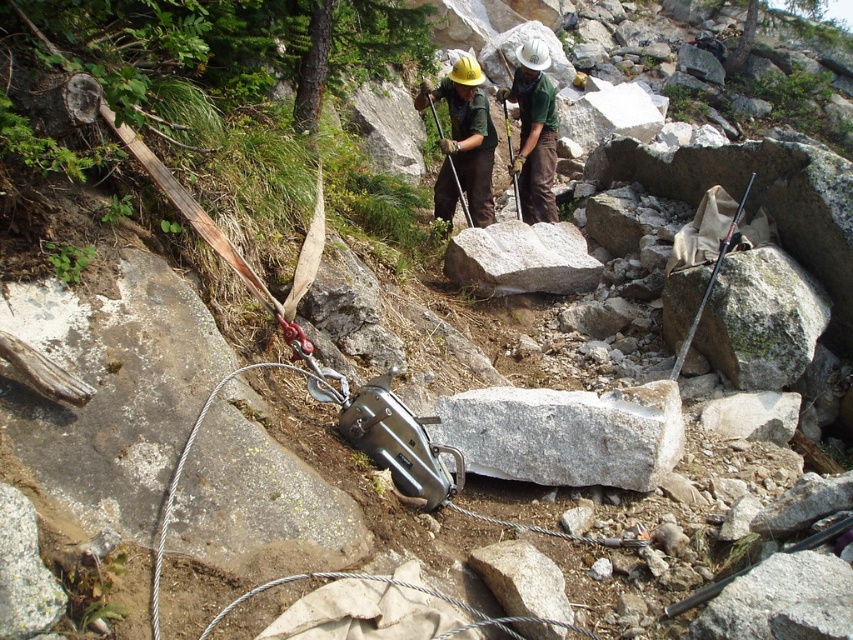
Is white smooth rock at center shorter than matte black tool at center?

No, white smooth rock at center is not shorter than matte black tool at center.

Is point (523, 240) positioned behind point (436, 113)?

No, (523, 240) is closer to viewer.

You are a GUI agent. You are given a task and a screenshot of the screen. Output one action in this format:
    pyautogui.click(x=<x>, y=<y>)
    Task: Click on the white smooth rock at center
    Image resolution: width=853 pixels, height=640 pixels.
    Given the screenshot: What is the action you would take?
    pyautogui.click(x=521, y=259)

This screenshot has height=640, width=853. Identify the location of white smooth rock at center. (521, 259).

Is green matte shirt at center below metallic silver tool at center?

Incorrect, green matte shirt at center is not positioned below metallic silver tool at center.

Can you confirm if green matte shirt at center is taller than metallic silver tool at center?

Indeed, green matte shirt at center has a greater height compared to metallic silver tool at center.

The image size is (853, 640). What do you see at coordinates (532, 131) in the screenshot?
I see `green matte shirt at center` at bounding box center [532, 131].

Where is `green matte shirt at center`? green matte shirt at center is located at coordinates (532, 131).

Is point (614, 396) positioned after point (531, 76)?

No, (614, 396) is closer to viewer.

Who is shorter, white granite block at center or green matte shirt at center?

white granite block at center is shorter.

Between point (614, 416) and point (538, 179), which one is positioned in front?

Positioned in front is point (614, 416).

Image resolution: width=853 pixels, height=640 pixels. Identify the location of white granite block at center. (566, 433).